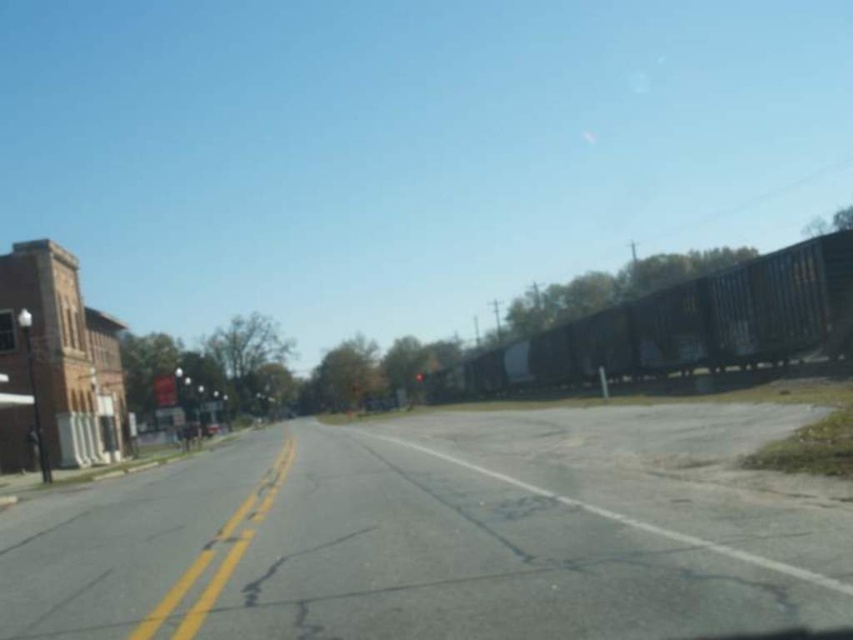
Is gray asphalt train track at center above metallic blue train car at right?

Incorrect, gray asphalt train track at center is not positioned above metallic blue train car at right.

Which is behind, point (465, 636) or point (480, 365)?

Positioned behind is point (480, 365).

Is point (552, 609) behind point (566, 356)?

No.

This screenshot has height=640, width=853. Identify the location of gray asphalt train track at center. (444, 532).